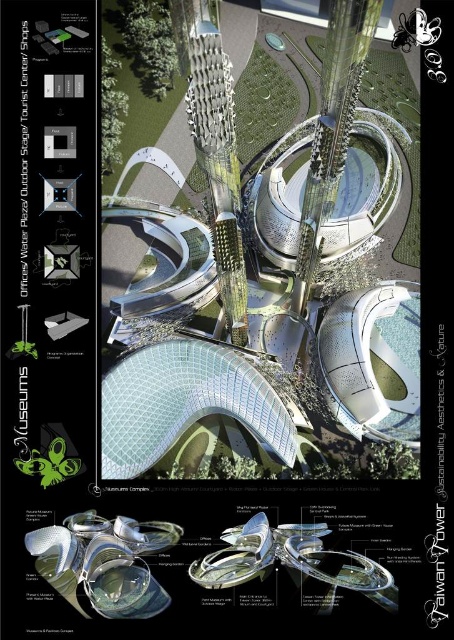
Question: Among these objects, which one is nearest to the camera?

Choices:
 (A) green matte sculpture at lower left
 (B) sleek silver tower at center

Answer: (B)

Question: Is sleek silver tower at center smaller than green matte sculpture at lower left?

Choices:
 (A) yes
 (B) no

Answer: (B)

Question: Where is sleek silver tower at center located in relation to green matte sculpture at lower left in the image?

Choices:
 (A) left
 (B) right

Answer: (B)

Question: Among these points, which one is farthest from the camera?

Choices:
 (A) (53, 465)
 (B) (217, 196)

Answer: (A)

Question: Which object is closer to the camera taking this photo?

Choices:
 (A) sleek silver tower at center
 (B) green matte sculpture at lower left

Answer: (A)

Question: Is sleek silver tower at center wider than green matte sculpture at lower left?

Choices:
 (A) no
 (B) yes

Answer: (A)